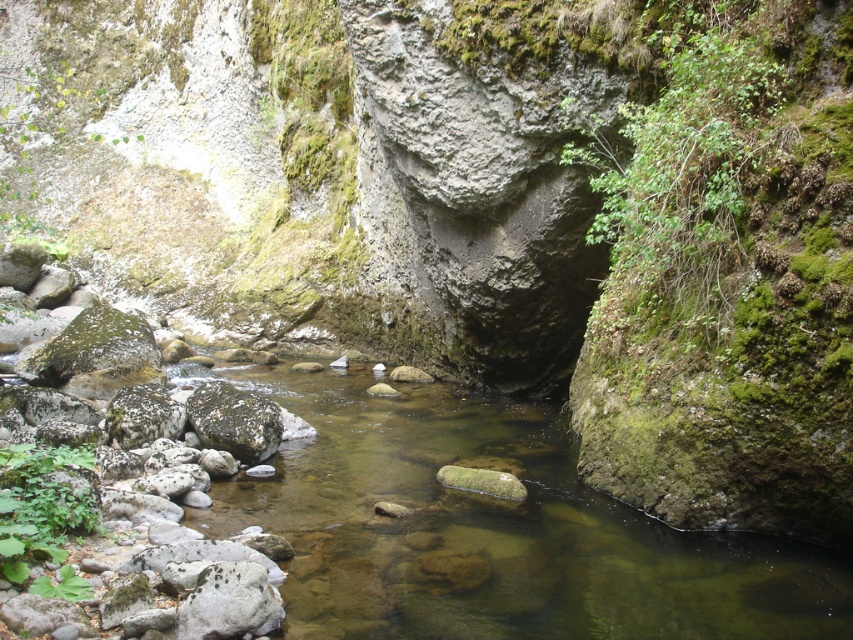
You are a hiker navigating the rocky canyon and want to cross the narrow stream. You notice two points marked on the map as point 1 at coordinates (338, 500) and point 2 at (201, 436). Which point should you choose to cross the stream if you want to take the path that is closer to the starting point?

You should choose point 2 at (201, 436) because it is closer to the starting point compared to point 1 at (338, 500).

You are standing at the point labeled as point [492,529] in the image. What can you see directly in front of you?

You can see the clear water stream at center directly in front of you at point [492,529].

You are a hiker trying to cross the stream. The clear water stream at center is flowing between the green mossy rock at center. Which object should you step on to cross safely?

You should step on the green mossy rock at center because it is smaller and more stable than the clear water stream at center, providing a safer crossing point.